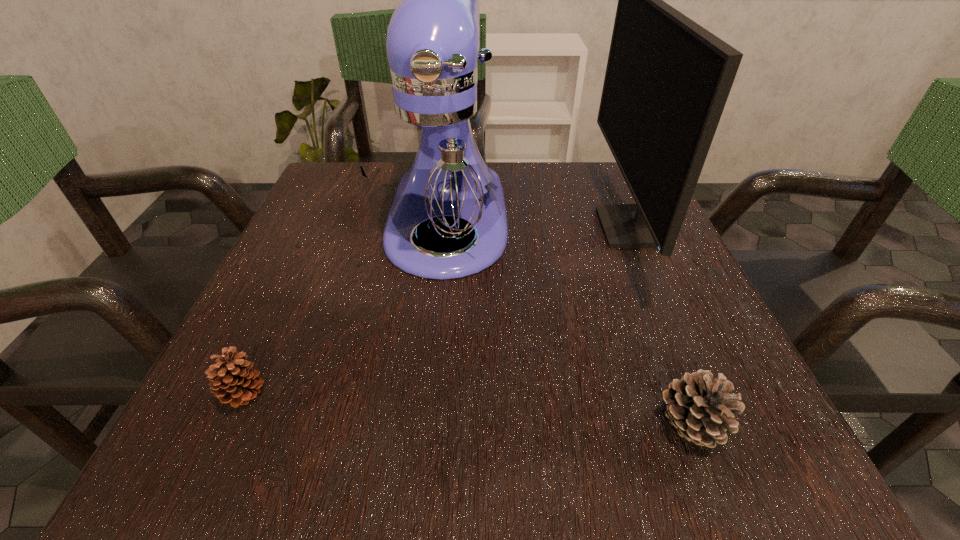
Locate an element on the screen. The height and width of the screenshot is (540, 960). mixer that is positioned at the far edge is located at coordinates (439, 168).

Find the location of a particular element. The height and width of the screenshot is (540, 960). computer monitor situated at the far edge is located at coordinates (667, 80).

Where is `object present at the left edge`? The width and height of the screenshot is (960, 540). object present at the left edge is located at coordinates (231, 381).

Identify the location of computer monitor located at the right edge. This screenshot has width=960, height=540. 667,80.

In order to click on pinecone that is positioned at the right edge in this screenshot , I will do `click(701, 410)`.

The width and height of the screenshot is (960, 540). Identify the location of object located at the near left corner. (231, 381).

At what (x,y) coordinates should I click in order to perform the action: click on object that is at the far right corner. Please return your answer as a coordinate pair (x, y). Looking at the image, I should click on (667, 80).

This screenshot has width=960, height=540. Find the location of `object situated at the near right corner`. object situated at the near right corner is located at coordinates pos(701,410).

Locate an element on the screen. The width and height of the screenshot is (960, 540). free spot at the far edge of the desktop is located at coordinates (545, 200).

Identify the location of vacant space at the near edge of the desktop. (555, 442).